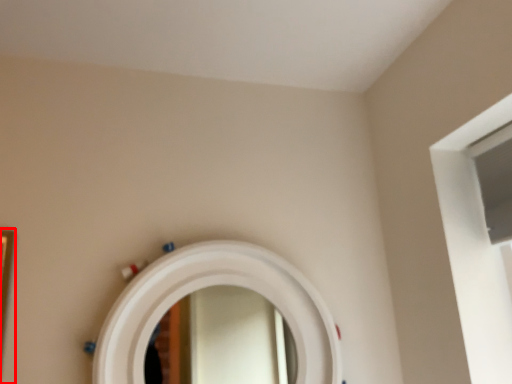
Question: Where is picture frame (annotated by the red box) located in relation to mirror in the image?

Choices:
 (A) left
 (B) right

Answer: (A)